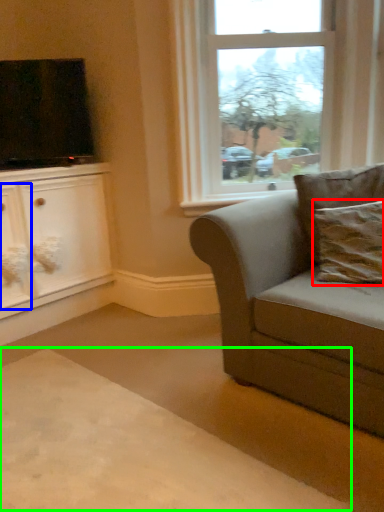
Question: Which object is positioned farthest from pillow (highlighted by a red box)? Select from drawer (highlighted by a blue box) and plain (highlighted by a green box).

Choices:
 (A) drawer
 (B) plain

Answer: (A)